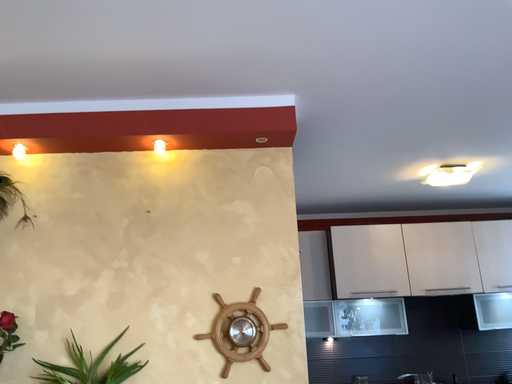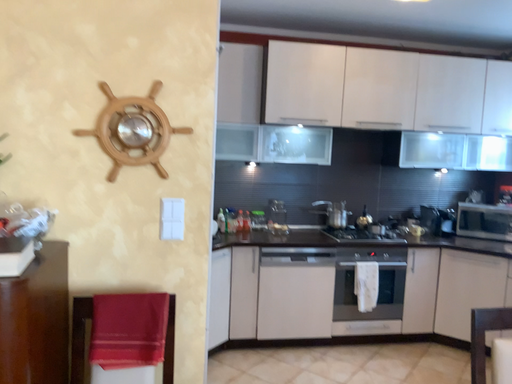
Question: How did the camera likely rotate when shooting the video?

Choices:
 (A) rotated upward
 (B) rotated downward

Answer: (B)